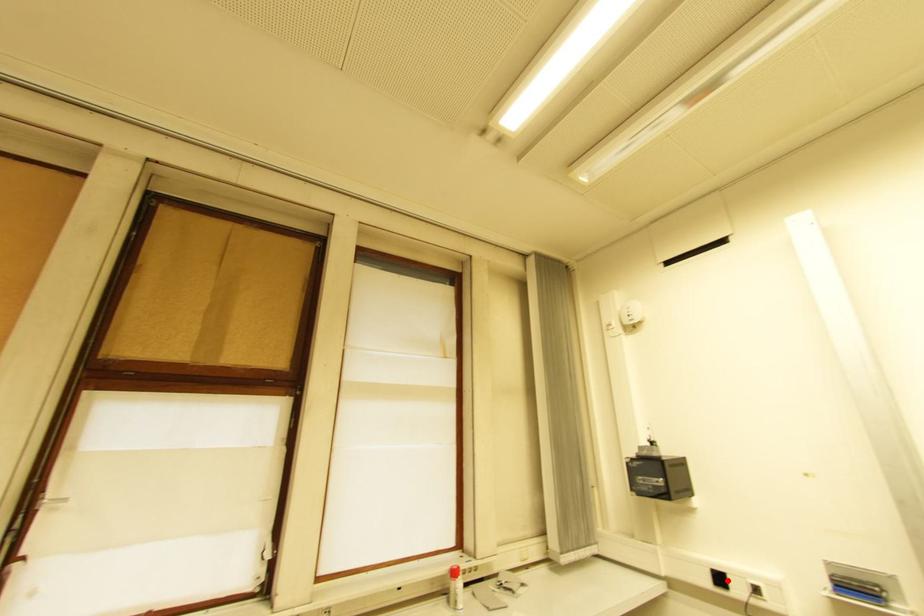
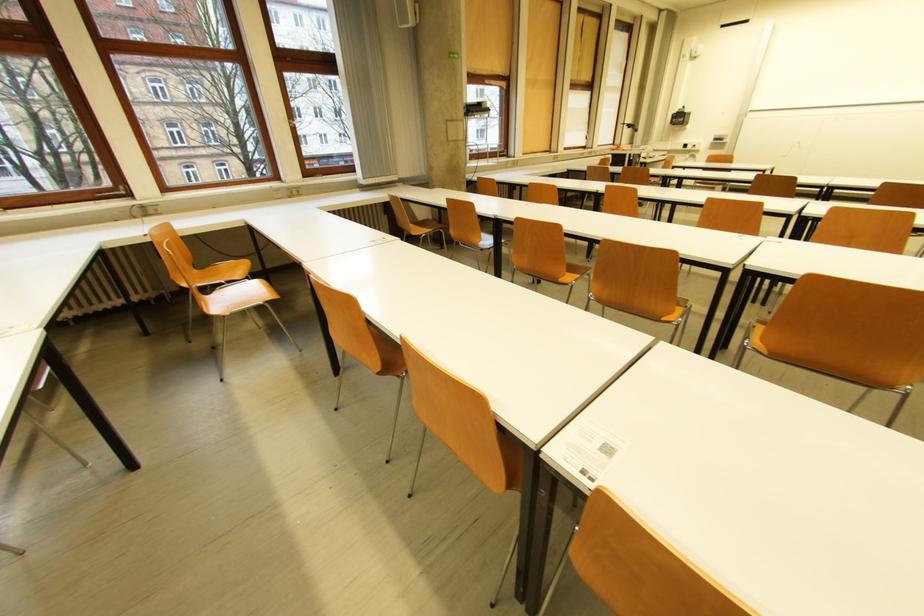
Locate, in the second image, the point that corresponds to the highlighted location in the first image.

(691, 147)